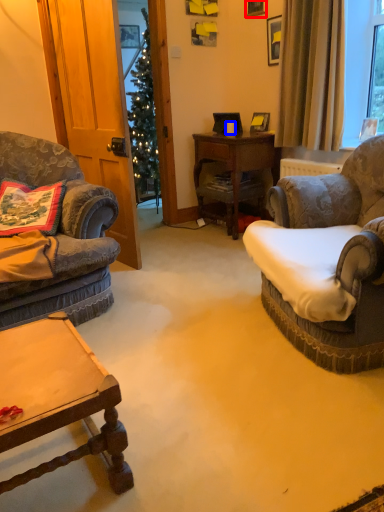
Question: Among these objects, which one is farthest to the camera, picture frame (highlighted by a red box) or coffee cup (highlighted by a blue box)?

Choices:
 (A) picture frame
 (B) coffee cup

Answer: (B)